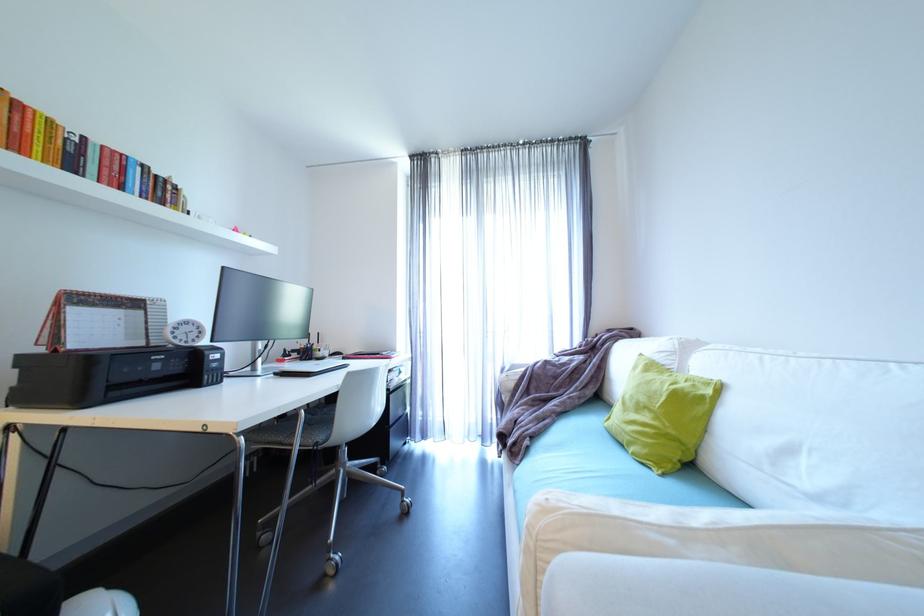
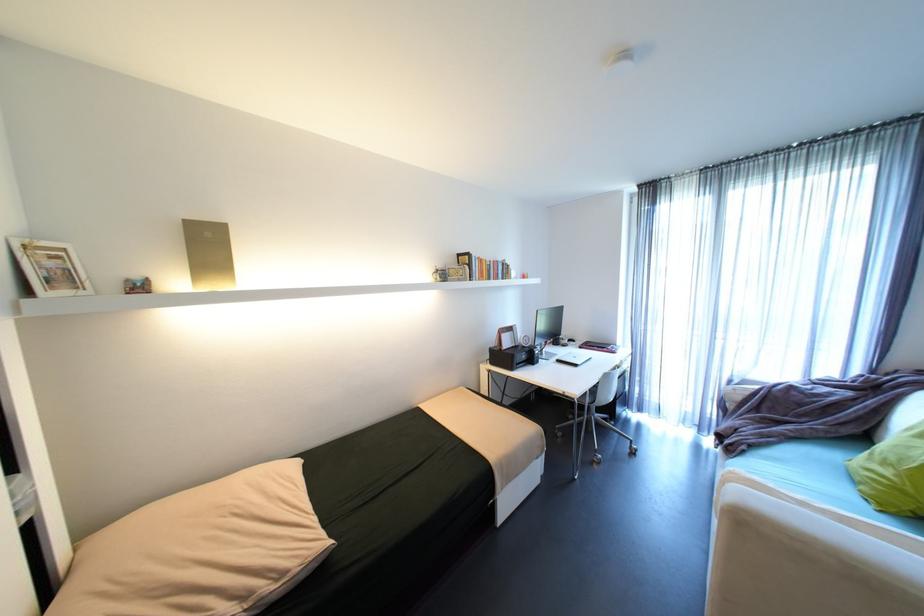
Locate, in the second image, the point that corresponds to [663,419] in the first image.

(906, 476)